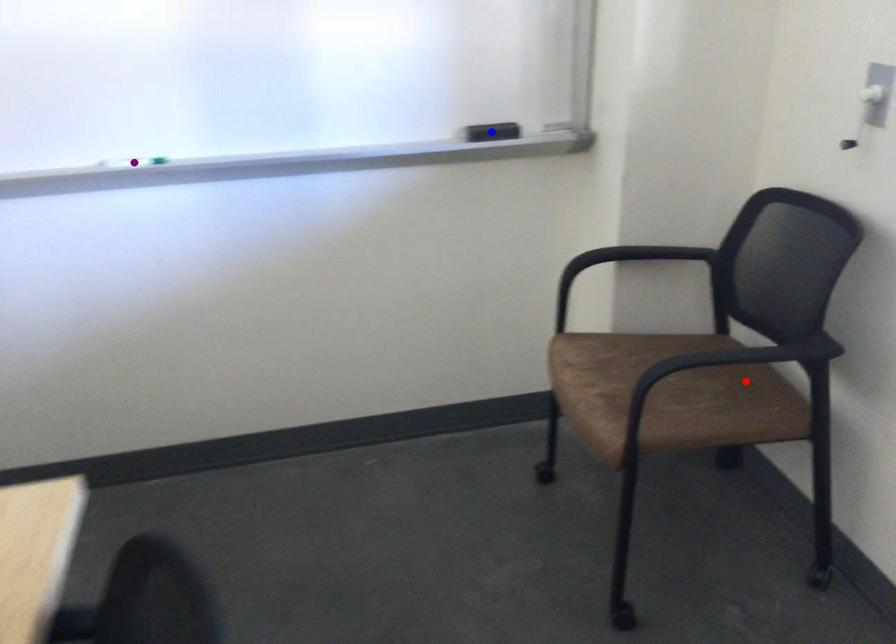
Order these from nearest to farthest:
red point | purple point | blue point

red point, purple point, blue point